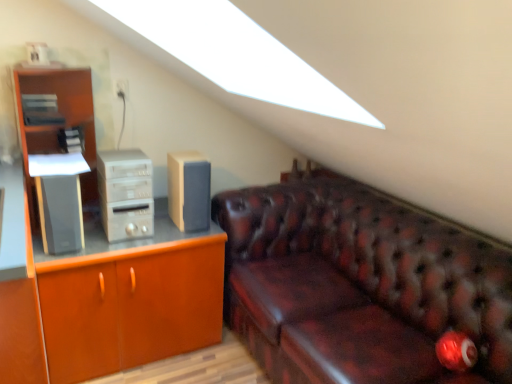
Question: Is satin silver computer tower at left surrounding leather couch at right?

Choices:
 (A) no
 (B) yes

Answer: (A)

Question: Is satin silver computer tower at left thinner than leather couch at right?

Choices:
 (A) yes
 (B) no

Answer: (A)

Question: From the image's perspective, is satin silver computer tower at left located beneath leather couch at right?

Choices:
 (A) no
 (B) yes

Answer: (A)

Question: Is satin silver computer tower at left bigger than leather couch at right?

Choices:
 (A) no
 (B) yes

Answer: (A)

Question: Is satin silver computer tower at left in front of leather couch at right?

Choices:
 (A) yes
 (B) no

Answer: (B)

Question: Is satin silver computer tower at left not close to leather couch at right?

Choices:
 (A) yes
 (B) no

Answer: (B)

Question: Is leather couch at right positioned beyond the bounds of satin silver computer tower at left?

Choices:
 (A) no
 (B) yes

Answer: (B)

Question: From a real-world perspective, does leather couch at right sit lower than satin silver computer tower at left?

Choices:
 (A) no
 (B) yes

Answer: (B)

Question: From a real-world perspective, is leather couch at right on top of satin silver computer tower at left?

Choices:
 (A) no
 (B) yes

Answer: (A)

Question: Can you confirm if leather couch at right is smaller than satin silver computer tower at left?

Choices:
 (A) no
 (B) yes

Answer: (A)

Question: Does leather couch at right turn towards satin silver computer tower at left?

Choices:
 (A) yes
 (B) no

Answer: (A)

Question: Considering the relative sizes of leather couch at right and satin silver computer tower at left in the image provided, is leather couch at right wider than satin silver computer tower at left?

Choices:
 (A) no
 (B) yes

Answer: (B)

Question: Is beige fabric speaker at center, which is the first speaker from right to left, at the right side of satin silver computer tower at left?

Choices:
 (A) yes
 (B) no

Answer: (A)